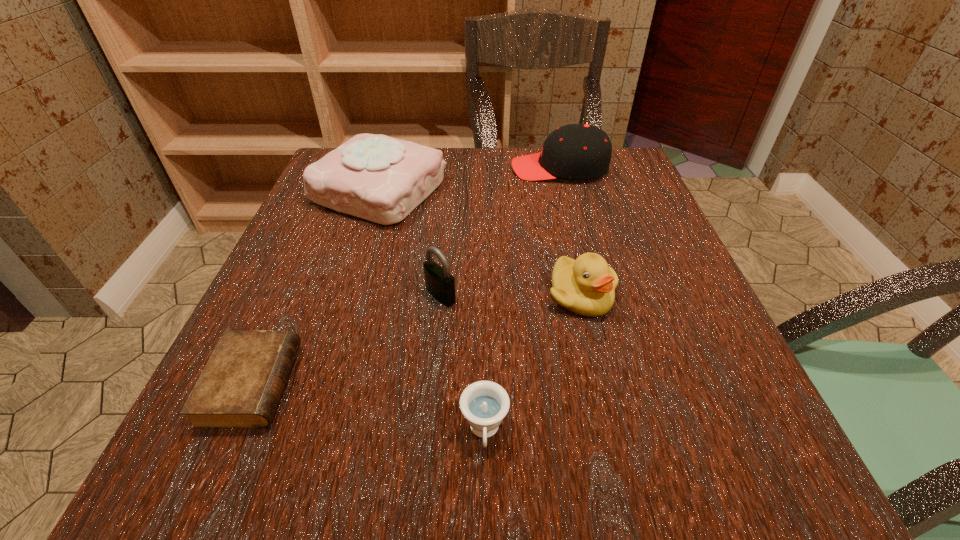
This screenshot has height=540, width=960. I want to click on free space that satisfies the following two spatial constraints: 1. on the front-facing side of the cap; 2. on the front-facing side of the duckling, so click(x=592, y=295).

This screenshot has height=540, width=960. What are the coordinates of `vacant area that satisfies the following two spatial constraints: 1. on the front-facing side of the cap; 2. on the front side of the cake` in the screenshot? It's located at (565, 190).

Find the location of a particular element. The width and height of the screenshot is (960, 540). vacant space that satisfies the following two spatial constraints: 1. on the front-facing side of the duckling; 2. on the spine side of the diary is located at coordinates (602, 384).

This screenshot has width=960, height=540. In order to click on free spot that satisfies the following two spatial constraints: 1. on the front-facing side of the cap; 2. on the side of the third object from right to left with the handle in this screenshot , I will do `click(629, 431)`.